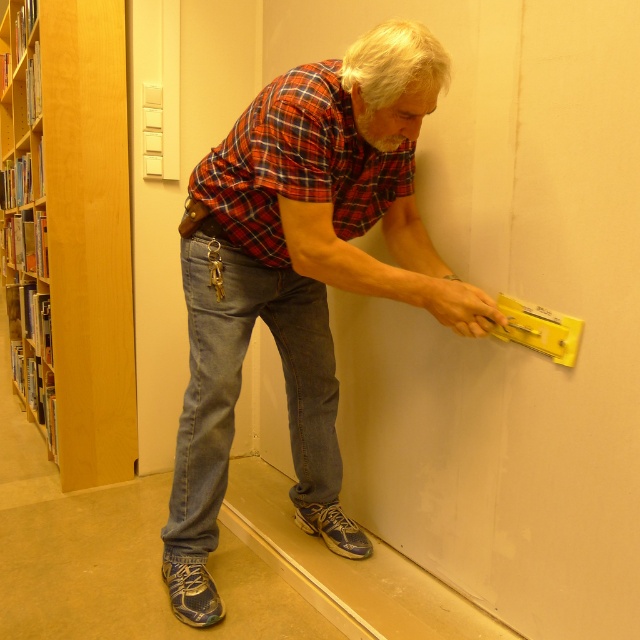
Is matte plaid shirt at center bigger than wooden bookshelf at left?

No, matte plaid shirt at center is not bigger than wooden bookshelf at left.

Which is behind, point (305, 488) or point (19, 84)?

The point (19, 84) is more distant.

Find the location of a particular element. This screenshot has height=640, width=640. matte plaid shirt at center is located at coordinates (300, 275).

Is point (58, 301) behind point (19, 388)?

No, it is not.

Which is more to the left, wooden bookcase at left or wooden bookshelf at left?

wooden bookshelf at left is more to the left.

Is point (120, 150) positioned before point (22, 134)?

Yes, it is.

This screenshot has width=640, height=640. I want to click on wooden bookcase at left, so click(72, 232).

Is point (198, 337) more distant than point (221, 180)?

Yes, it is behind point (221, 180).

Is matte plaid shirt at center taller than red plaid shirt at center?

Correct, matte plaid shirt at center is much taller as red plaid shirt at center.

Is point (225, 275) more distant than point (339, 196)?

No, it is in front of (339, 196).

Locate an element on the screen. The height and width of the screenshot is (640, 640). matte plaid shirt at center is located at coordinates coord(300,275).